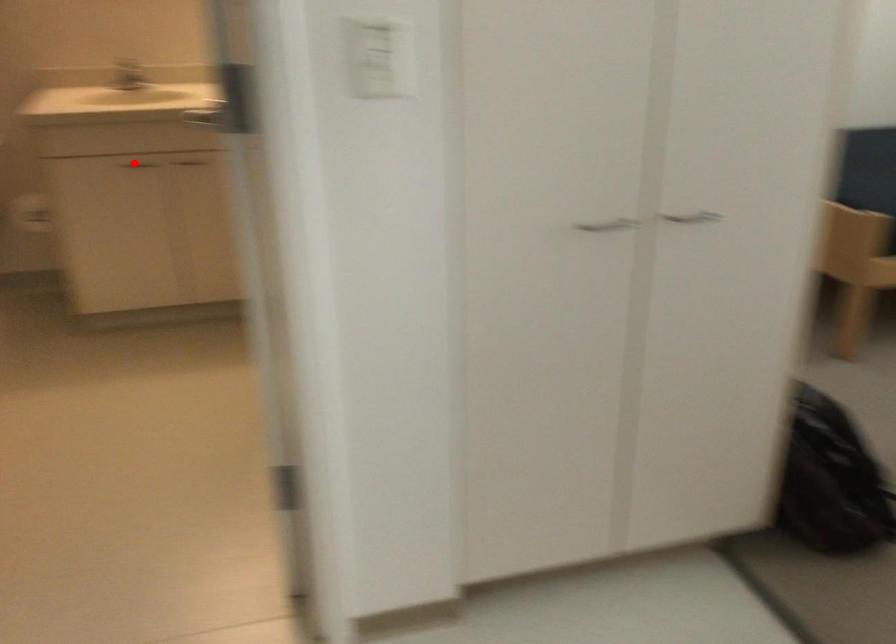
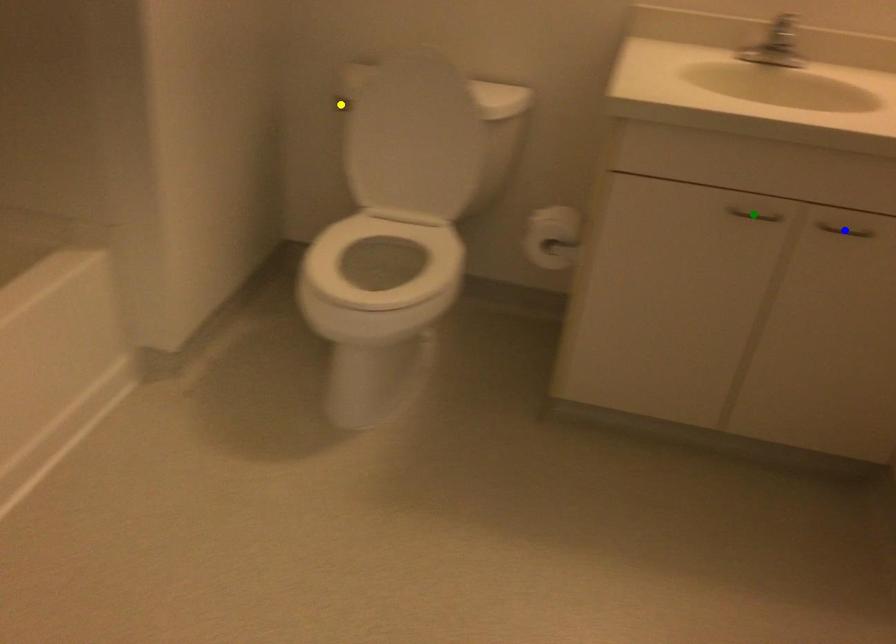
Question: I am providing you with two images of the same scene from different viewpoints. A red point is marked on the first image. You are given multiple points on the second image. Which point in image 2 is actually the same real-world point as the red point in image 1?

Choices:
 (A) green point
 (B) yellow point
 (C) blue point

Answer: (A)